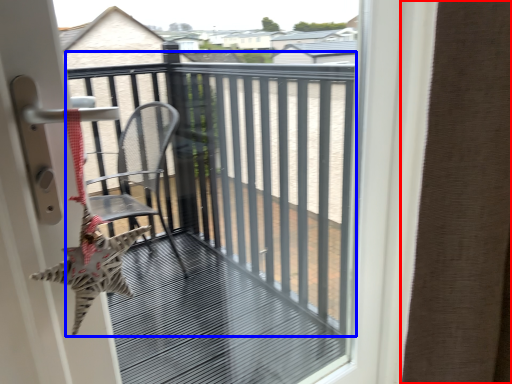
Question: Which of the following is the closest to the observer, curtain (highlighted by a red box) or balcony (highlighted by a blue box)?

Choices:
 (A) curtain
 (B) balcony

Answer: (A)